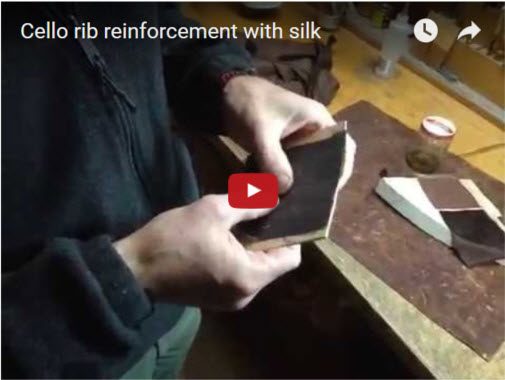
Where is `table`? table is located at coordinates (424, 294).